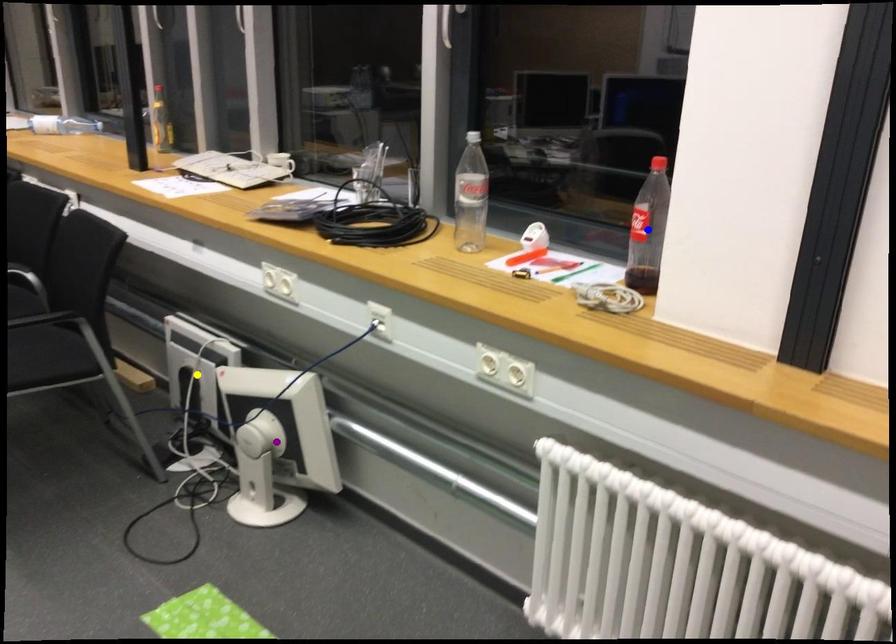
Order these from farthest to nearest:
1. purple point
2. yellow point
3. blue point

yellow point
purple point
blue point